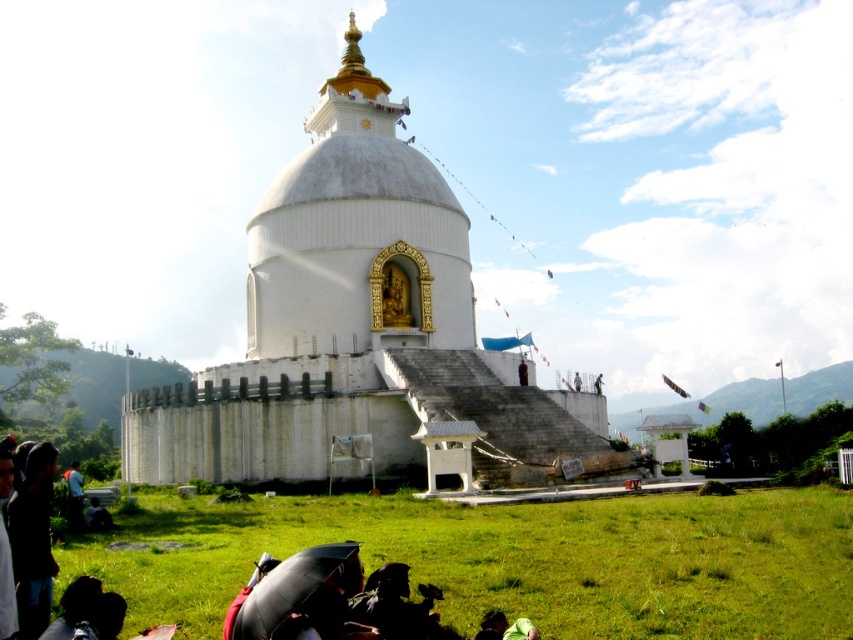
Question: Estimate the real-world distances between objects in this image. Which object is farther from the green grass at lower center?

Choices:
 (A) dark blue jeans at lower left
 (B) green fabric at lower center

Answer: (A)

Question: Can you confirm if green grass at lower center is smaller than green fabric at lower center?

Choices:
 (A) yes
 (B) no

Answer: (B)

Question: Considering the real-world distances, which object is closest to the white stone stupa at center?

Choices:
 (A) green grass at lower center
 (B) dark blue jeans at lower left

Answer: (A)

Question: Can you confirm if white stone stupa at center is positioned to the right of green grass at lower center?

Choices:
 (A) yes
 (B) no

Answer: (B)

Question: Estimate the real-world distances between objects in this image. Which object is closer to the white stone stupa at center?

Choices:
 (A) dark blue jeans at lower left
 (B) green grass at lower center
 (C) green fabric at lower center

Answer: (B)

Question: Does green grass at lower center have a larger size compared to green fabric at lower center?

Choices:
 (A) no
 (B) yes

Answer: (B)